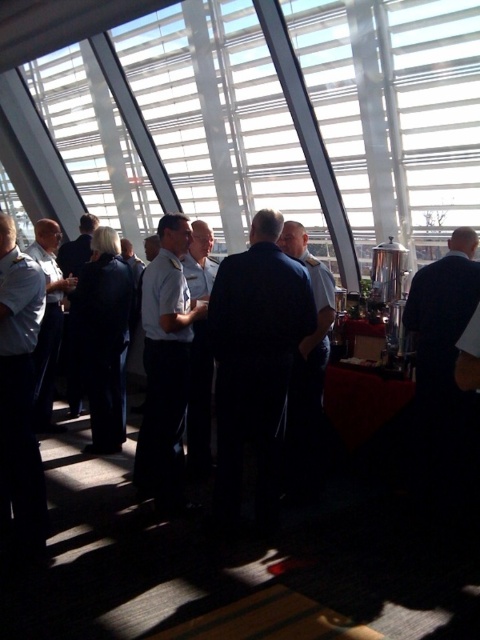
The height and width of the screenshot is (640, 480). Find the location of `dark blue suit at center`. dark blue suit at center is located at coordinates (254, 364).

Is dark blue suit at center to the right of light blue uniform at center from the viewer's perspective?

Indeed, dark blue suit at center is positioned on the right side of light blue uniform at center.

Is point (276, 509) behind point (58, 333)?

No, (276, 509) is closer to viewer.

The image size is (480, 640). Find the location of `dark blue suit at center`. dark blue suit at center is located at coordinates (254, 364).

Does light blue uniform at left lie in front of light blue uniform at center?

Yes, light blue uniform at left is closer to the viewer.

Is light blue uniform at left to the right of light blue uniform at center from the viewer's perspective?

Correct, you'll find light blue uniform at left to the right of light blue uniform at center.

Is point (38, 531) more distant than point (52, 376)?

No, (38, 531) is in front of (52, 376).

What are the coordinates of `light blue uniform at left` in the screenshot? It's located at (20, 394).

Is point (157, 362) farther from camera compared to point (2, 212)?

Yes.

Does white shirt at center appear over light blue uniform at left?

Indeed, white shirt at center is positioned over light blue uniform at left.

Find the location of a particular element. white shirt at center is located at coordinates (166, 368).

I want to click on white shirt at center, so click(x=166, y=368).